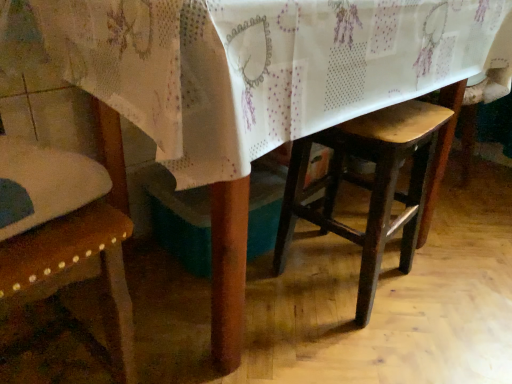
Where is `free space in front of wooden stool at center`? free space in front of wooden stool at center is located at coordinates (358, 345).